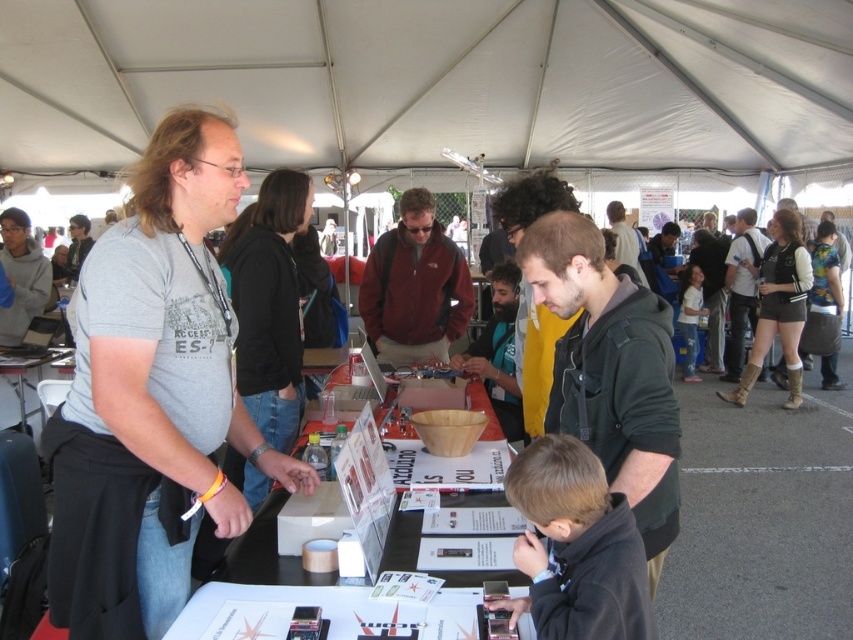
Question: Does brown suede boots at lower right have a lesser width compared to brown leather boots at right?

Choices:
 (A) yes
 (B) no

Answer: (B)

Question: Among these objects, which one is farthest from the camera?

Choices:
 (A) yellow fabric shirt at center
 (B) black hoodie at center
 (C) white paper at center
 (D) brown leather boots at right

Answer: (A)

Question: From the image, what is the correct spatial relationship of dark green hoodie at center in relation to matte gray hoodie at upper left?

Choices:
 (A) above
 (B) below

Answer: (B)

Question: Which is nearer to the yellow fabric shirt at center?

Choices:
 (A) gray t-shirt at upper left
 (B) matte gray hoodie at upper left
 (C) black hoodie at center

Answer: (C)

Question: From the image, what is the correct spatial relationship of brown suede boots at lower right in relation to floral fabric baby carrier at center?

Choices:
 (A) above
 (B) below

Answer: (B)

Question: Which object appears farthest from the camera in this image?

Choices:
 (A) matte red jacket at center
 (B) brown suede boots at lower right
 (C) dark green hoodie at center
 (D) black hoodie at center

Answer: (B)